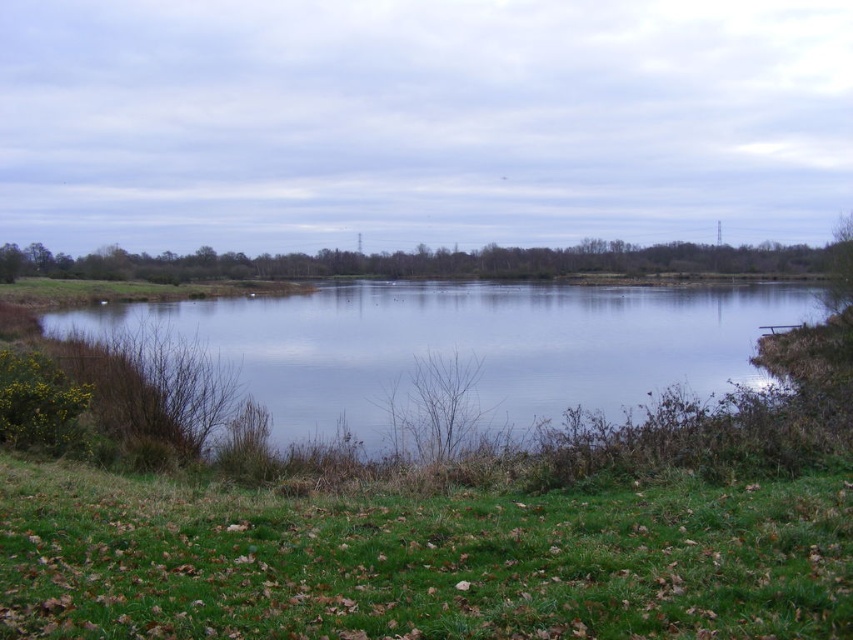
You are standing on the green grassy at lower left and want to reach the transparent water at center. Which direction should you move to get there?

You should move upwards to reach the transparent water at center since the green grassy at lower left is below it.

You are standing at the edge of the lake and see two points on the ground. The first point is at coordinates point (523,634) and the second is at point (192,326). Which point is closer to you?

Point (523,634) is closer to the camera than point (192,326), so the first point is closer to you.

You are standing at the edge of the water and want to step onto the green grassy at lower left. Which direction should you move to reach it without entering the transparent water at center?

The green grassy at lower left is located at the lower left side of the scene, so you should move towards the lower left direction to reach it without stepping into the transparent water at center.